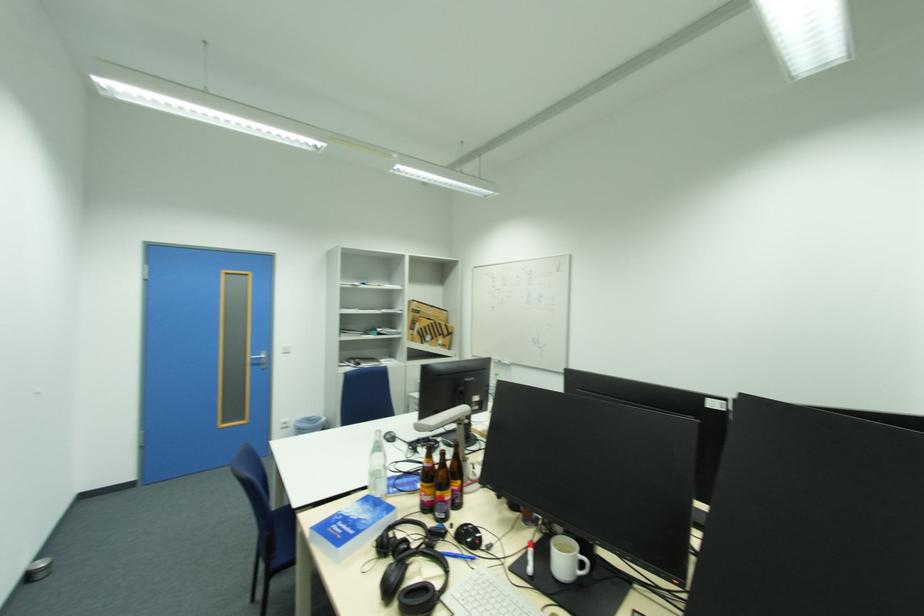
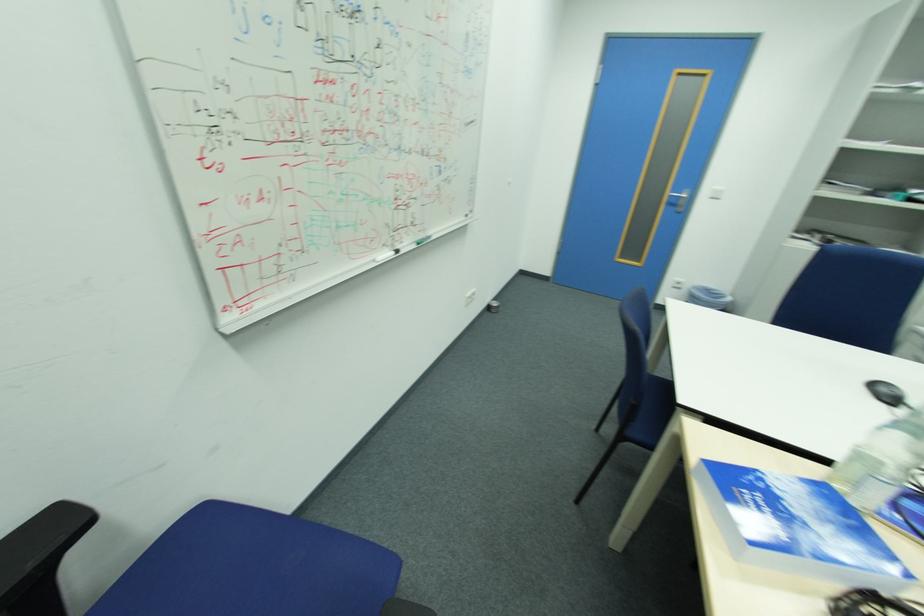
Find the pixel in the second image that matches [360,517] in the first image.

(796, 512)